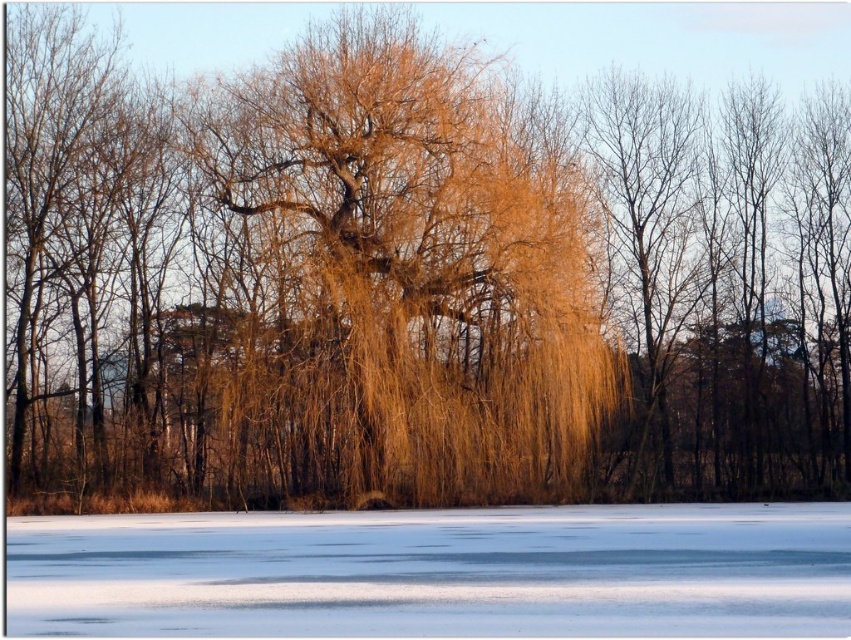
Question: Where is golden textured willow at center located in relation to white ice at lower center in the image?

Choices:
 (A) right
 (B) left

Answer: (B)

Question: Which point appears closest to the camera in this image?

Choices:
 (A) (545, 355)
 (B) (113, 630)

Answer: (B)

Question: Where is golden textured willow at center located in relation to white ice at lower center in the image?

Choices:
 (A) below
 (B) above

Answer: (B)

Question: Which point appears farthest from the camera in this image?

Choices:
 (A) (489, 291)
 (B) (63, 518)

Answer: (A)

Question: Among these points, which one is farthest from the camera?

Choices:
 (A) (758, 592)
 (B) (580, 412)

Answer: (B)

Question: Is golden textured willow at center above white ice at lower center?

Choices:
 (A) no
 (B) yes

Answer: (B)